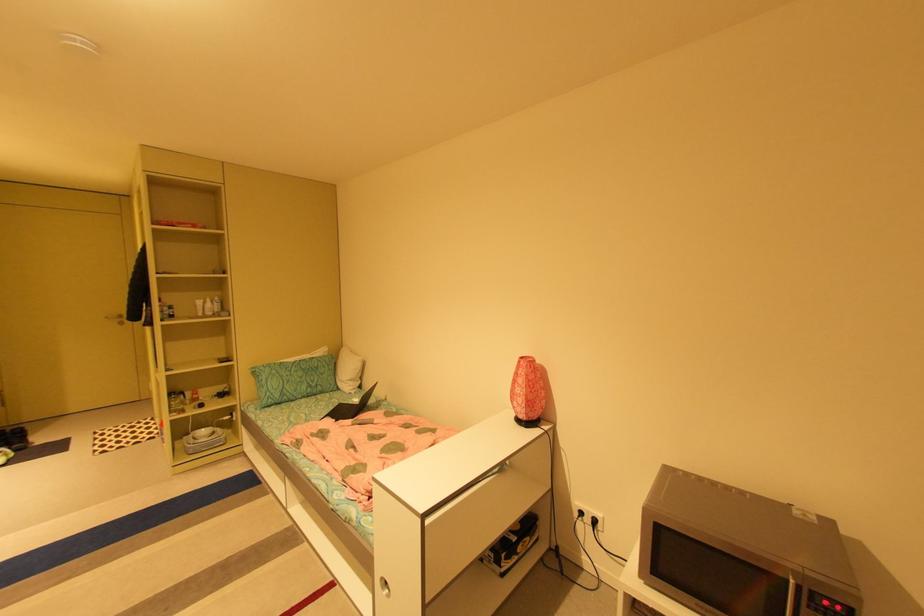
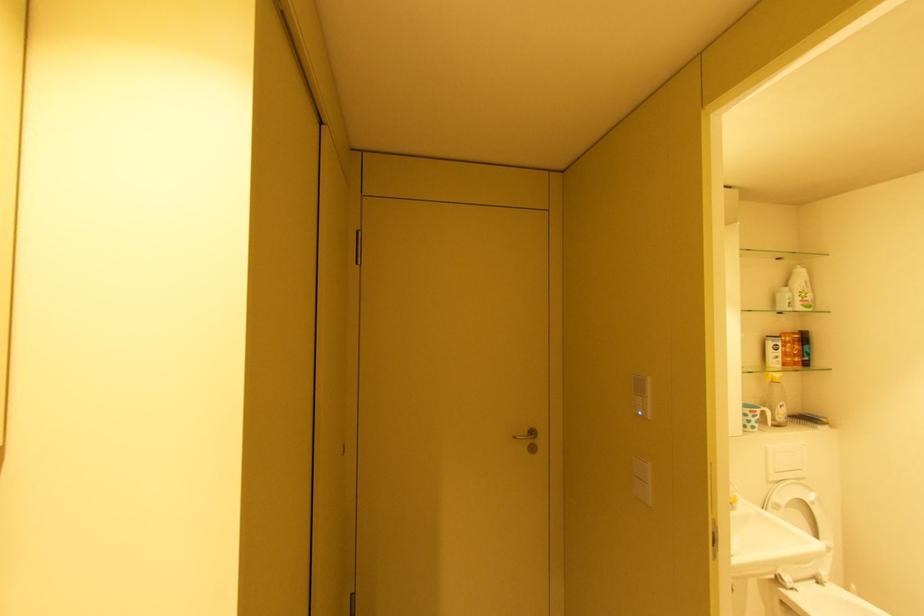
Where in the second image is the point corresponding to the point at 113,318 from the first image?

(520, 438)